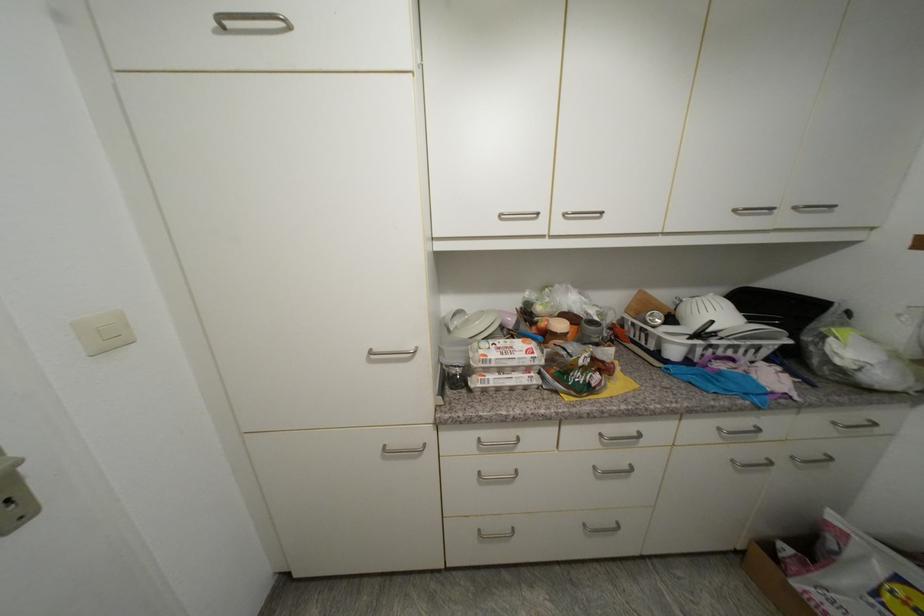
The width and height of the screenshot is (924, 616). In order to click on carton of eggs in this screenshot , I will do `click(506, 355)`.